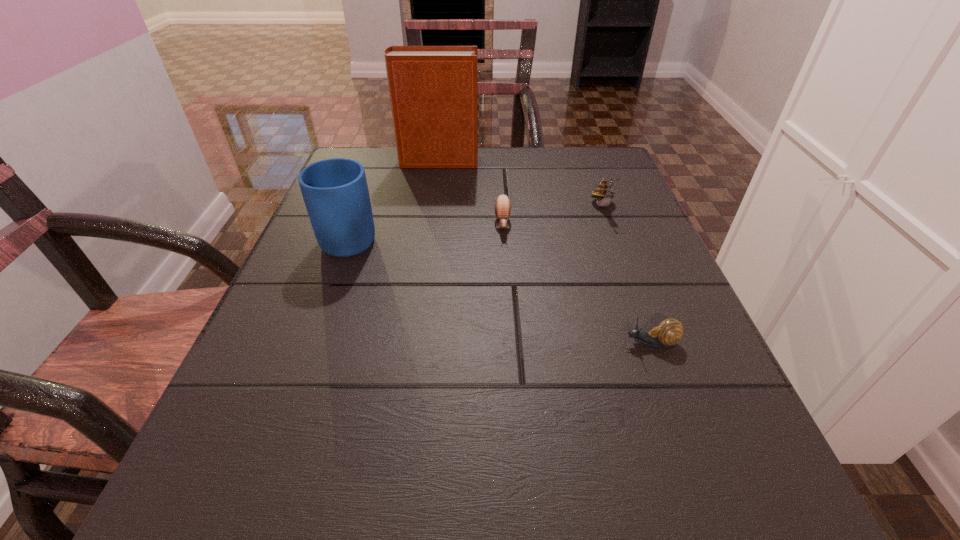
In order to click on the tallest object in this screenshot , I will do `click(433, 89)`.

Where is `hardback book`? This screenshot has height=540, width=960. hardback book is located at coordinates click(433, 89).

Identify the location of the second tallest object. This screenshot has width=960, height=540. (335, 191).

Image resolution: width=960 pixels, height=540 pixels. In order to click on the third shortest object in this screenshot , I will do `click(603, 192)`.

At what (x,y) coordinates should I click in order to perform the action: click on the third object from left to right. Please return your answer as a coordinate pair (x, y). Looking at the image, I should click on (502, 205).

Where is `the shortest object`? the shortest object is located at coordinates (669, 332).

Where is `the shortest escargot`? the shortest escargot is located at coordinates (669, 332).

What are the coordinates of `blank space located 0.330m on the open cover of the tallest object` in the screenshot? It's located at (610, 161).

The width and height of the screenshot is (960, 540). I want to click on free location located on the side of the second tallest object with the handle, so click(367, 193).

Where is `vacant space situated on the side of the second tallest object with the handle`? vacant space situated on the side of the second tallest object with the handle is located at coordinates (377, 163).